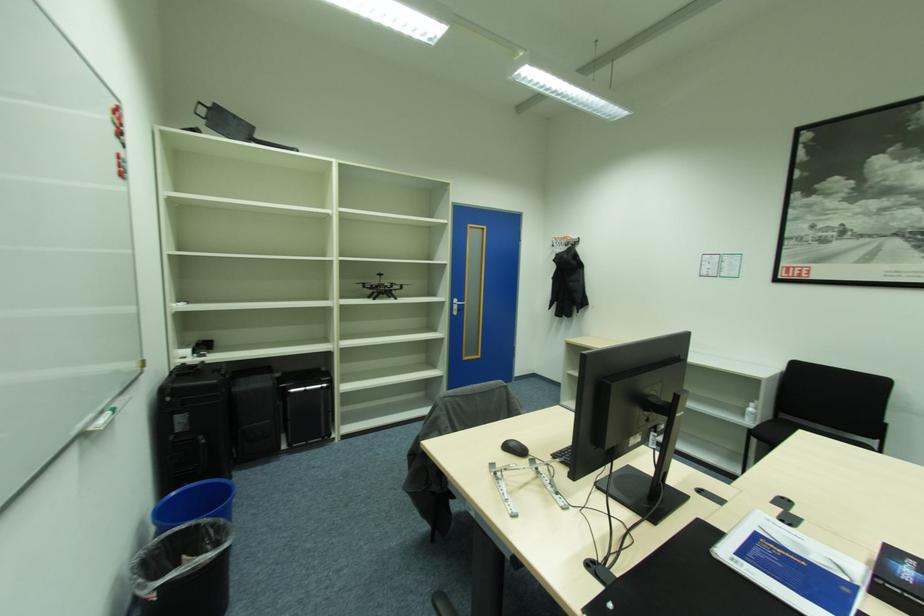
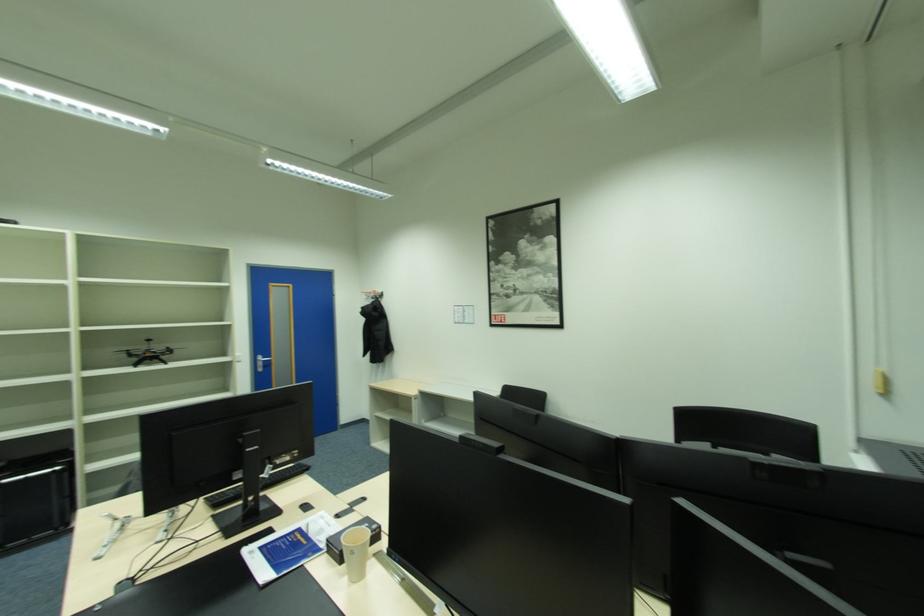
Which direction would the cameraman need to move to produce the second image?

The cameraman moved toward right, backward.